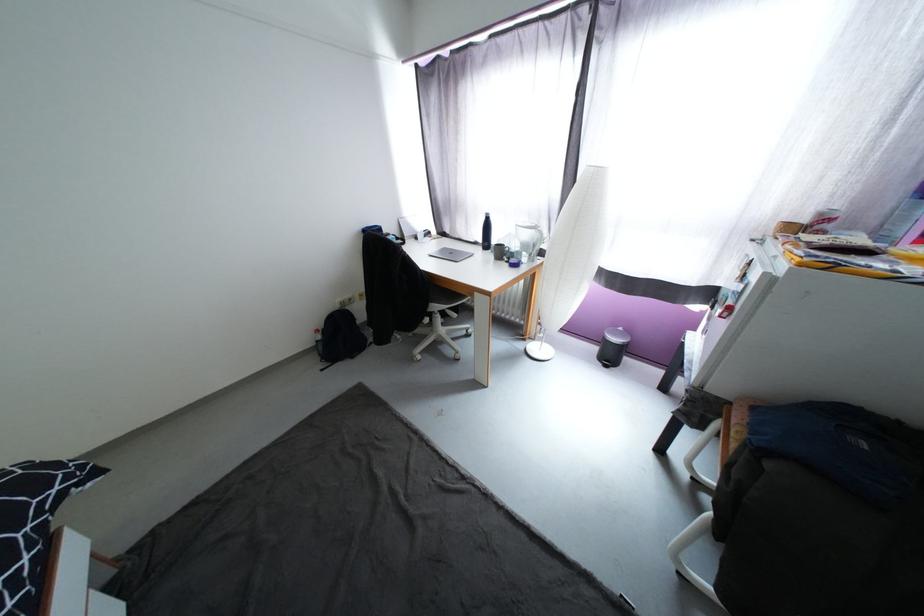
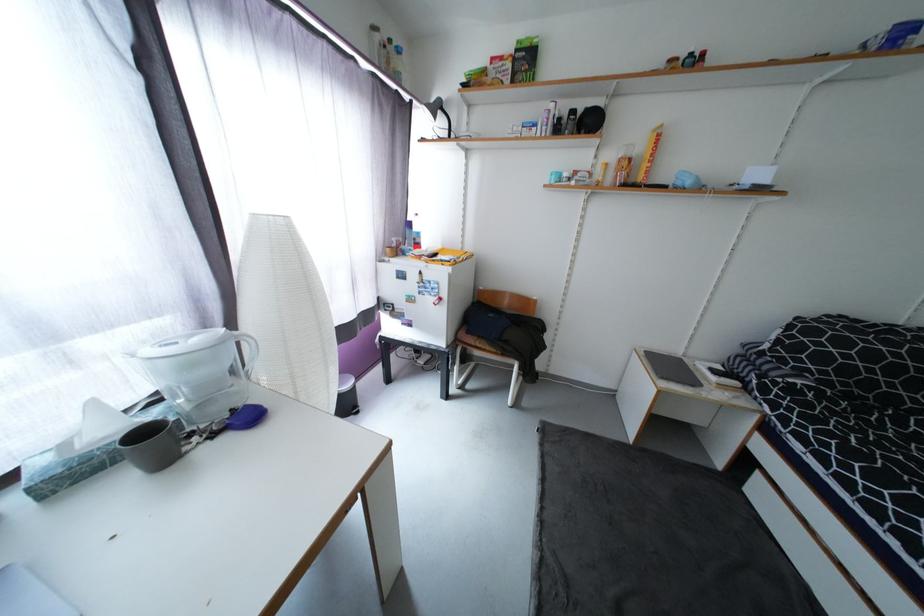
The point at (492, 498) is marked in the first image. Where is the corresponding point in the second image?

(548, 524)